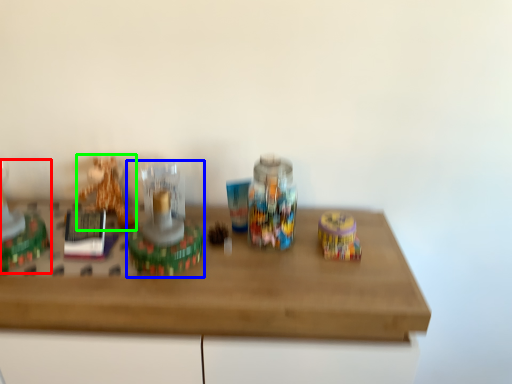
Question: Which object is the closest to the toy (highlighted by a red box)? Choose among these: toy (highlighted by a blue box) or toy (highlighted by a green box).

Choices:
 (A) toy
 (B) toy

Answer: (B)